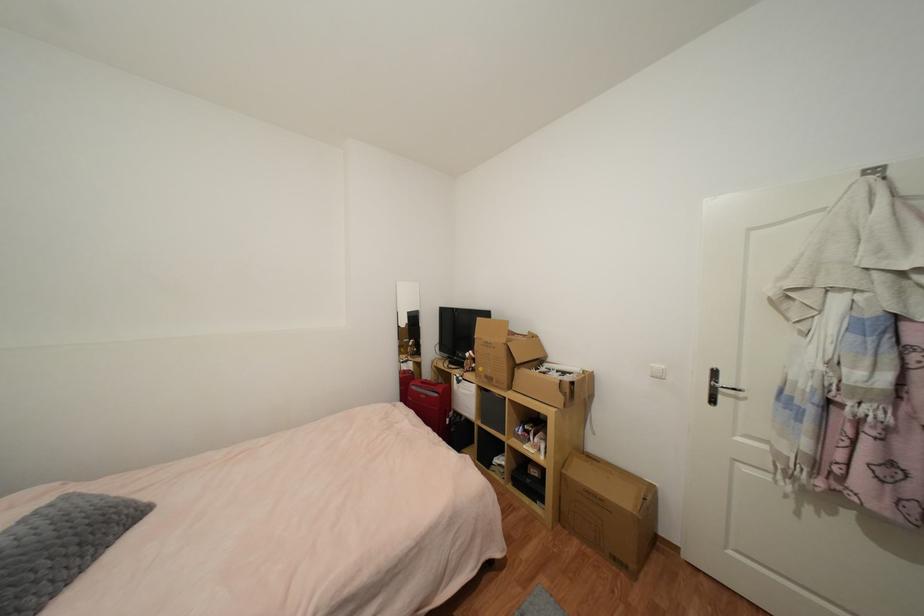
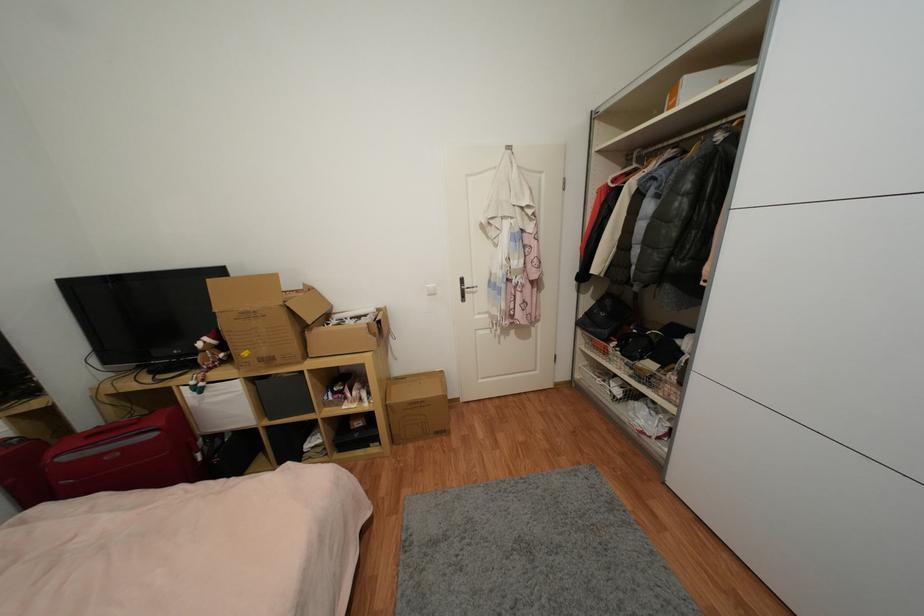
Find the pixel in the second image that matches the point at 564,517 in the first image.

(397, 440)